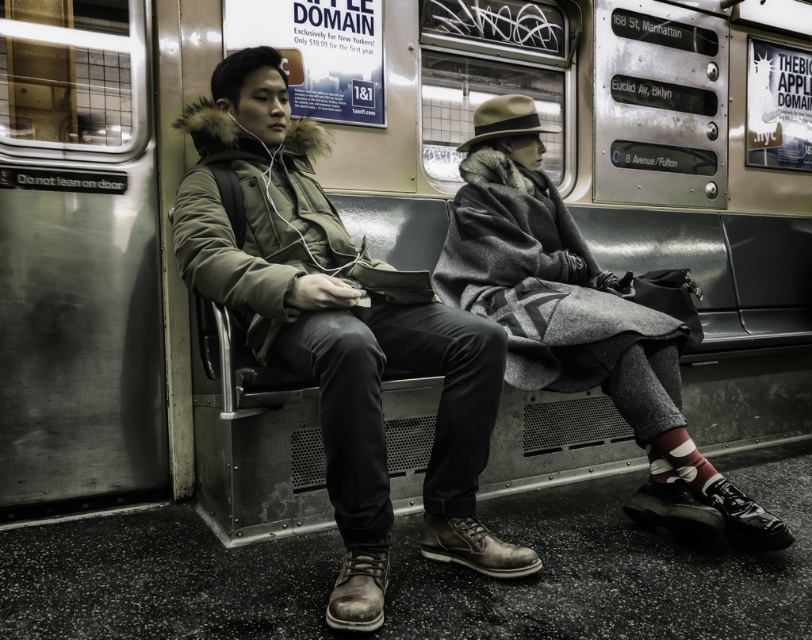
Is point (717, 502) farther from camera compared to point (541, 230)?

No.

Locate an element on the screen. The image size is (812, 640). matte green coat at center is located at coordinates (335, 339).

Which is in front, point (274, 333) or point (642, 385)?

Point (274, 333) is more forward.

Locate an element on the screen. The image size is (812, 640). matte green coat at center is located at coordinates (335, 339).